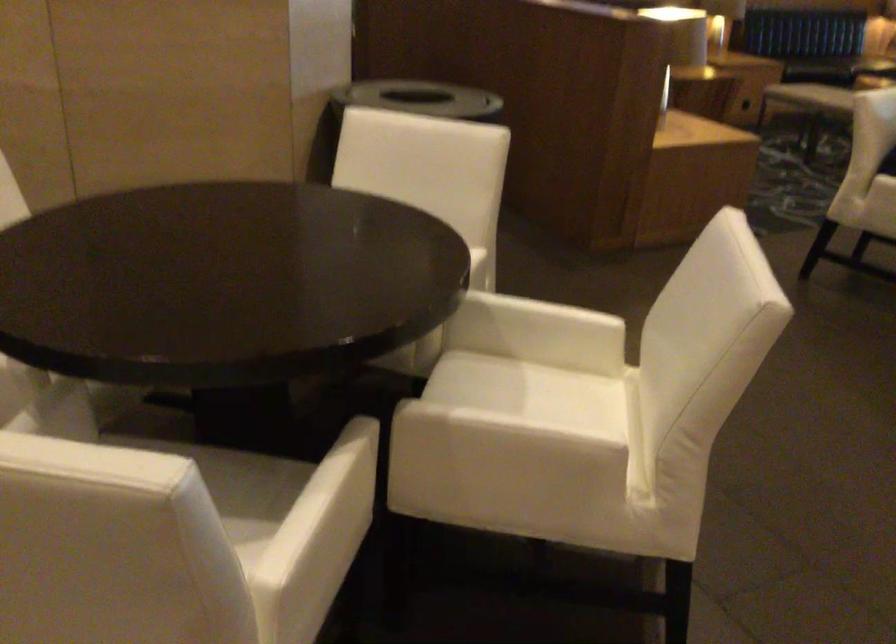
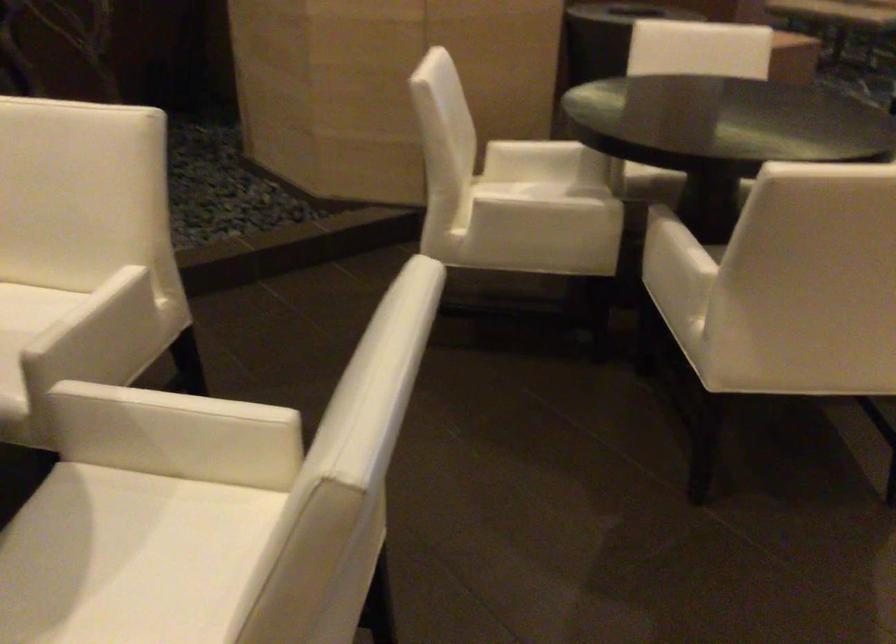
Question: I am providing you with two images of the same scene from different viewpoints. Which of the following objects are not visible in image2?

Choices:
 (A) chair sitting surface
 (B) white chair armrest
 (C) white chair sitting surface
 (D) rolled teal mat

Answer: (A)